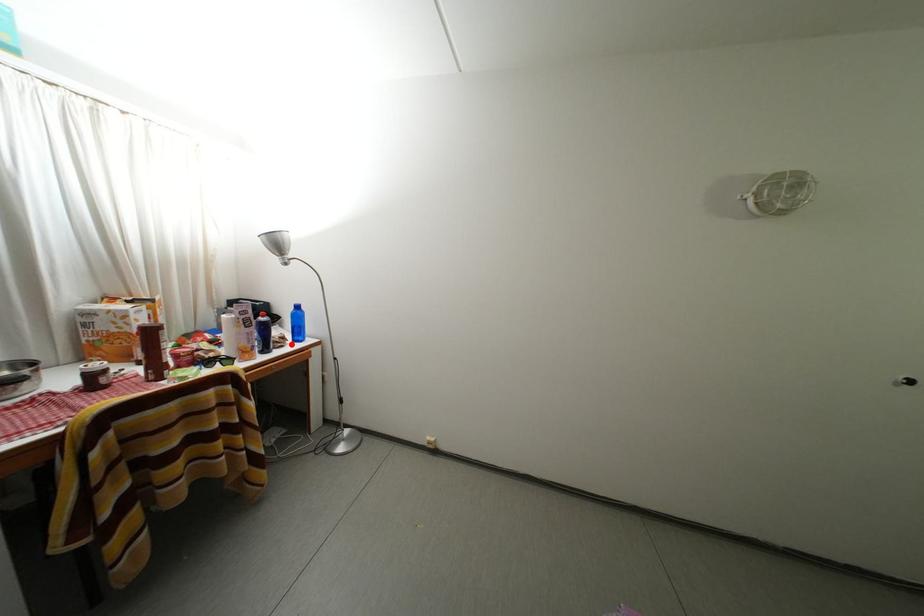
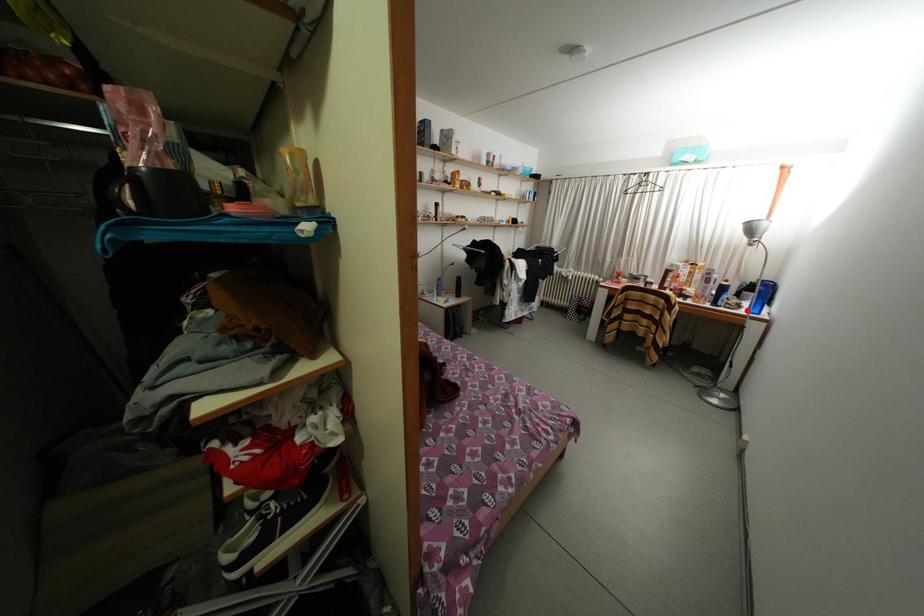
I am providing you with two images of the same scene from different viewpoints. A red point is marked on the first image and another point is marked on the second image. Is the marked point in image1 the same physical position as the marked point in image2?

Yes